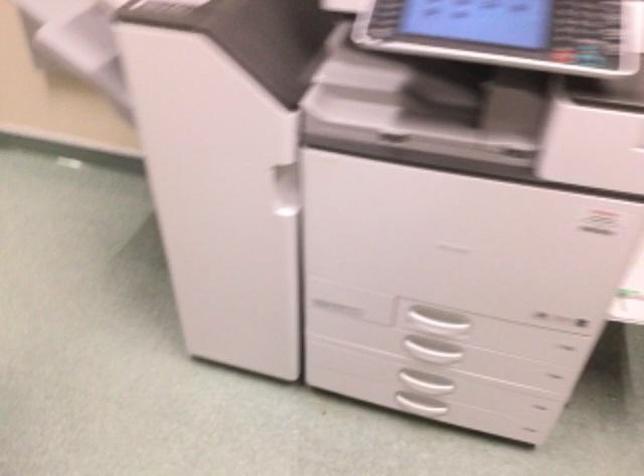
Find the location of a particular element. The width and height of the screenshot is (644, 476). printer side handle is located at coordinates (438, 318).